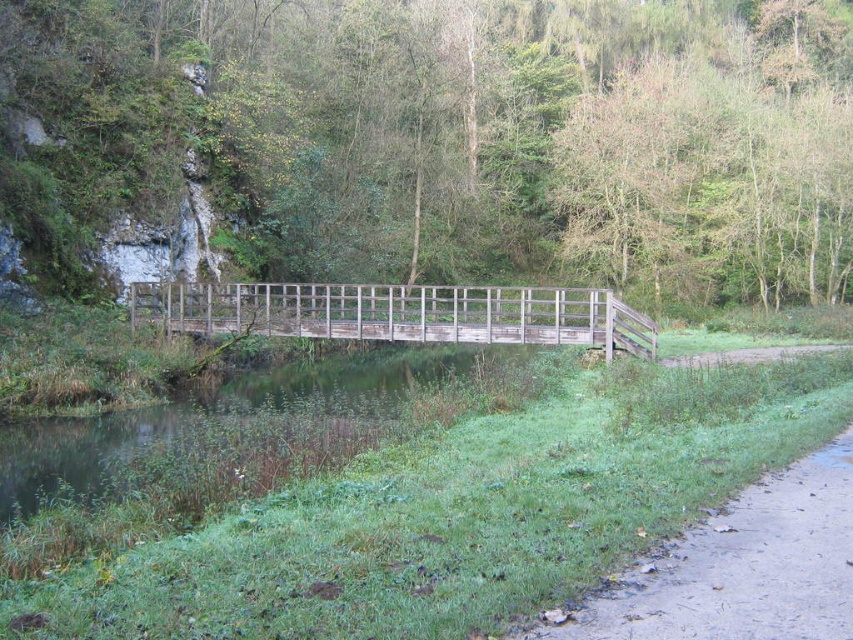
From the picture: Does dirt path at lower right appear under weathered wood bridge at center?

Correct, dirt path at lower right is located below weathered wood bridge at center.

Between point (830, 589) and point (525, 285), which one is positioned in front?

Point (830, 589)

The width and height of the screenshot is (853, 640). Find the location of `dirt path at lower right`. dirt path at lower right is located at coordinates (740, 566).